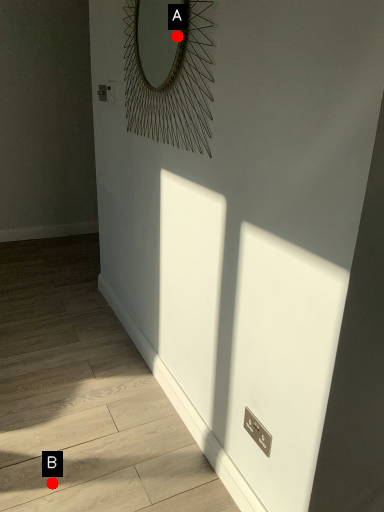
Question: Two points are circled on the image, labeled by A and B beside each circle. Which point appears farthest from the camera in this image?

Choices:
 (A) A is further
 (B) B is further

Answer: (A)